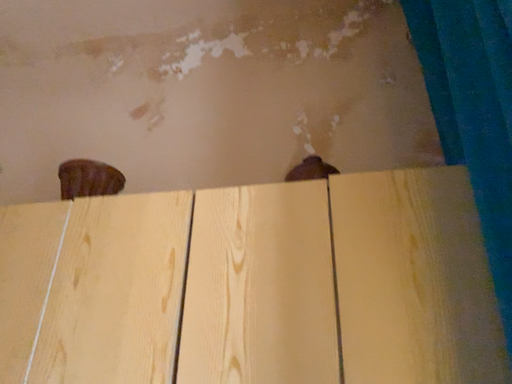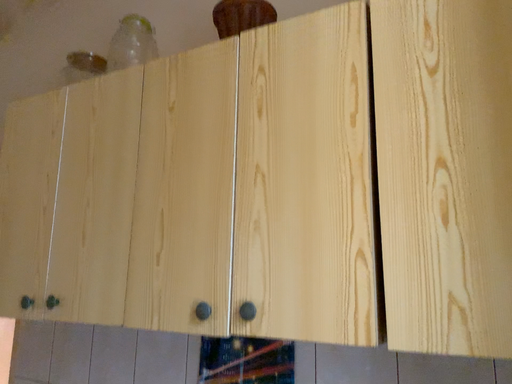
Question: How did the camera likely rotate when shooting the video?

Choices:
 (A) rotated right
 (B) rotated left

Answer: (B)